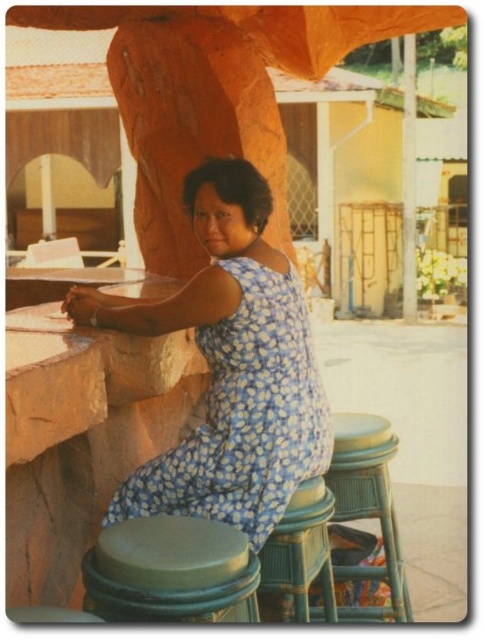
Find the location of a particular element. blue floral fabric dress at center is located at coordinates click(x=243, y=417).

From the picture: Is blue floral fabric dress at center positioned in front of green rubber bar stool at lower center?

No, blue floral fabric dress at center is behind green rubber bar stool at lower center.

This screenshot has height=640, width=485. I want to click on blue floral fabric dress at center, so pos(243,417).

Is teal wood bar stool at lower center thinner than smooth stone pillar at center?

Yes.

Who is lower down, teal wood bar stool at lower center or smooth stone pillar at center?

teal wood bar stool at lower center

Is point (393, 609) positioned in front of point (408, 248)?

That is True.

Find the location of `teal wood bar stool at lower center`. teal wood bar stool at lower center is located at coordinates (368, 506).

Is teal wood bar stool at lower center to the right of green plastic bar stool at lower center from the viewer's perspective?

Correct, you'll find teal wood bar stool at lower center to the right of green plastic bar stool at lower center.

Which is below, teal wood bar stool at lower center or green plastic bar stool at lower center?

green plastic bar stool at lower center is lower down.

Locate an element on the screen. The height and width of the screenshot is (640, 485). teal wood bar stool at lower center is located at coordinates (368, 506).

The height and width of the screenshot is (640, 485). Identify the location of teal wood bar stool at lower center. (368, 506).